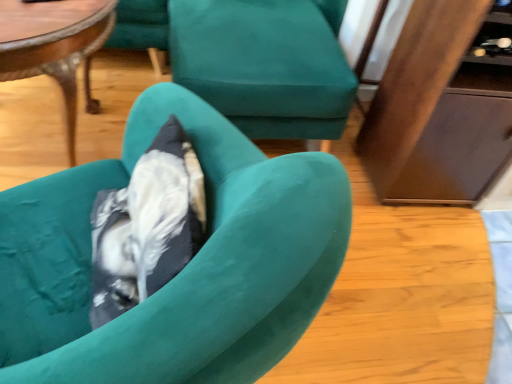
Locate an element on the screen. The width and height of the screenshot is (512, 384). wooden dresser at right is located at coordinates [441, 108].

Describe the element at coordinates (441, 108) in the screenshot. The width and height of the screenshot is (512, 384). I see `wooden dresser at right` at that location.

What is the approximate height of wooden polished coffee table at upper left?

wooden polished coffee table at upper left is 27.87 inches in height.

This screenshot has height=384, width=512. In order to click on velvet teal armchair at center, which ranks as the 2th chair in top-to-bottom order in this screenshot , I will do `click(183, 270)`.

Can you confirm if velvet teal armchair at center, acting as the 2th chair starting from the back, is positioned to the right of wooden dresser at right?

No, velvet teal armchair at center, acting as the 2th chair starting from the back, is not to the right of wooden dresser at right.

Does velvet teal armchair at center, acting as the 2th chair starting from the back, lie behind wooden dresser at right?

No, it is not.

Is wooden dresser at right at the back of velvet teal armchair at center, acting as the first chair starting from the front?

Yes.

Considering the sizes of objects wooden dresser at right and teal fabric chair at center, which ranks as the 1th chair in back-to-front order, in the image provided, who is shorter, wooden dresser at right or teal fabric chair at center, which ranks as the 1th chair in back-to-front order,?

teal fabric chair at center, which ranks as the 1th chair in back-to-front order.

Is wooden dresser at right situated inside teal fabric chair at center, which is the 2th chair in bottom-to-top order, or outside?

wooden dresser at right is outside teal fabric chair at center, which is the 2th chair in bottom-to-top order.

Is point (402, 54) behind point (192, 38)?

No, it is not.

From the picture: What's the angular difference between teal fabric chair at center, arranged as the first chair when viewed from the top, and wooden dresser at right's facing directions?

They differ by 1.64 degrees in their facing directions.

Which is behind, point (257, 75) or point (419, 10)?

The point (257, 75) is behind.

In terms of width, does teal fabric chair at center, arranged as the first chair when viewed from the top, look wider or thinner when compared to wooden dresser at right?

In the image, teal fabric chair at center, arranged as the first chair when viewed from the top, appears to be wider than wooden dresser at right.

From a real-world perspective, is teal fabric chair at center, arranged as the first chair when viewed from the top, above or below wooden dresser at right?

From a real-world perspective, teal fabric chair at center, arranged as the first chair when viewed from the top, is physically below wooden dresser at right.

The height and width of the screenshot is (384, 512). I want to click on coffee table below the teal fabric chair at center, which ranks as the 1th chair in back-to-front order (from the image's perspective), so click(x=56, y=50).

Is wooden polished coffee table at upper left aimed at teal fabric chair at center, which is the 2th chair in front-to-back order?

No.

From the image's perspective, is wooden polished coffee table at upper left located beneath teal fabric chair at center, arranged as the first chair when viewed from the top?

Correct, wooden polished coffee table at upper left appears lower than teal fabric chair at center, arranged as the first chair when viewed from the top, in the image.

How many degrees apart are the facing directions of wooden polished coffee table at upper left and teal fabric chair at center, which is the 2th chair in bottom-to-top order?

wooden polished coffee table at upper left and teal fabric chair at center, which is the 2th chair in bottom-to-top order, are facing 2.5 degrees away from each other.

Where is `coffee table located underneath the teal fabric chair at center, arranged as the first chair when viewed from the top (from a real-world perspective)`? The height and width of the screenshot is (384, 512). coffee table located underneath the teal fabric chair at center, arranged as the first chair when viewed from the top (from a real-world perspective) is located at coordinates (56, 50).

Is teal fabric chair at center, which ranks as the 1th chair in back-to-front order, directly adjacent to wooden polished coffee table at upper left?

No, teal fabric chair at center, which ranks as the 1th chair in back-to-front order, is not beside wooden polished coffee table at upper left.

From a real-world perspective, who is located higher, teal fabric chair at center, which is the 2th chair in front-to-back order, or wooden polished coffee table at upper left?

From a 3D spatial view, teal fabric chair at center, which is the 2th chair in front-to-back order, is above.

Is teal fabric chair at center, arranged as the first chair when viewed from the top, completely or partially inside velvet teal armchair at center, which ranks as the 2th chair in top-to-bottom order?

No, velvet teal armchair at center, which ranks as the 2th chair in top-to-bottom order, does not contain teal fabric chair at center, arranged as the first chair when viewed from the top.

Which object is further away from the camera taking this photo, velvet teal armchair at center, which ranks as the 2th chair in top-to-bottom order, or teal fabric chair at center, which is the 2th chair in front-to-back order?

Positioned behind is teal fabric chair at center, which is the 2th chair in front-to-back order.

Which is more to the left, velvet teal armchair at center, acting as the first chair starting from the front, or teal fabric chair at center, which is the 2th chair in bottom-to-top order?

velvet teal armchair at center, acting as the first chair starting from the front.

Considering the relative sizes of velvet teal armchair at center, positioned as the first chair in bottom-to-top order, and teal fabric chair at center, which is the 2th chair in front-to-back order, in the image provided, is velvet teal armchair at center, positioned as the first chair in bottom-to-top order, bigger than teal fabric chair at center, which is the 2th chair in front-to-back order,?

No, velvet teal armchair at center, positioned as the first chair in bottom-to-top order, is not bigger than teal fabric chair at center, which is the 2th chair in front-to-back order.

Is wooden polished coffee table at upper left next to velvet teal armchair at center, which ranks as the 2th chair in top-to-bottom order?

No, wooden polished coffee table at upper left is not with velvet teal armchair at center, which ranks as the 2th chair in top-to-bottom order.

Between wooden polished coffee table at upper left and velvet teal armchair at center, positioned as the first chair in bottom-to-top order, which one appears on the right side from the viewer's perspective?

velvet teal armchair at center, positioned as the first chair in bottom-to-top order, is more to the right.

From the image's perspective, is wooden polished coffee table at upper left on velvet teal armchair at center, which ranks as the 2th chair in top-to-bottom order?

Yes.

Does wooden polished coffee table at upper left turn towards velvet teal armchair at center, acting as the first chair starting from the front?

Yes, wooden polished coffee table at upper left faces towards velvet teal armchair at center, acting as the first chair starting from the front.

Image resolution: width=512 pixels, height=384 pixels. I want to click on chair located above the wooden dresser at right (from a real-world perspective), so click(183, 270).

Identify the location of chair above the wooden dresser at right (from the image's perspective). Image resolution: width=512 pixels, height=384 pixels. (264, 65).

Based on their spatial positions, is teal fabric chair at center, which is the 2th chair in bottom-to-top order, or velvet teal armchair at center, which ranks as the 2th chair in top-to-bottom order, closer to wooden polished coffee table at upper left?

The object closer to wooden polished coffee table at upper left is velvet teal armchair at center, which ranks as the 2th chair in top-to-bottom order.

Estimate the real-world distances between objects in this image. Which object is closer to teal fabric chair at center, which is the 2th chair in bottom-to-top order, velvet teal armchair at center, acting as the first chair starting from the front, or wooden polished coffee table at upper left?

wooden polished coffee table at upper left.

When comparing their distances from wooden dresser at right, does teal fabric chair at center, arranged as the first chair when viewed from the top, or velvet teal armchair at center, acting as the 2th chair starting from the back, seem closer?

teal fabric chair at center, arranged as the first chair when viewed from the top, is positioned closer to the anchor wooden dresser at right.

From the image, which object appears to be nearer to teal fabric chair at center, which is the 2th chair in bottom-to-top order, wooden polished coffee table at upper left or wooden dresser at right?

wooden dresser at right is closer to teal fabric chair at center, which is the 2th chair in bottom-to-top order.

Estimate the real-world distances between objects in this image. Which object is closer to teal fabric chair at center, arranged as the first chair when viewed from the top, velvet teal armchair at center, which ranks as the 2th chair in top-to-bottom order, or wooden dresser at right?

wooden dresser at right is positioned closer to the anchor teal fabric chair at center, arranged as the first chair when viewed from the top.

Which object lies nearer to the anchor point wooden polished coffee table at upper left, velvet teal armchair at center, acting as the first chair starting from the front, or teal fabric chair at center, which is the 2th chair in front-to-back order?

velvet teal armchair at center, acting as the first chair starting from the front, is closer to wooden polished coffee table at upper left.

Looking at the image, which one is located closer to wooden dresser at right, wooden polished coffee table at upper left or velvet teal armchair at center, which ranks as the 2th chair in top-to-bottom order?

velvet teal armchair at center, which ranks as the 2th chair in top-to-bottom order, lies closer to wooden dresser at right than the other object.

Estimate the real-world distances between objects in this image. Which object is closer to wooden polished coffee table at upper left, wooden dresser at right or velvet teal armchair at center, acting as the 2th chair starting from the back?

velvet teal armchair at center, acting as the 2th chair starting from the back, lies closer to wooden polished coffee table at upper left than the other object.

Locate an element on the screen. The width and height of the screenshot is (512, 384). coffee table between teal fabric chair at center, which is the 2th chair in bottom-to-top order, and velvet teal armchair at center, acting as the 2th chair starting from the back, in the vertical direction is located at coordinates (56, 50).

You are a GUI agent. You are given a task and a screenshot of the screen. Output one action in this format:
    pyautogui.click(x=<x>, y=<y>)
    Task: Click on the chair between velvet teal armchair at center, which ranks as the 2th chair in top-to-bottom order, and wooden dresser at right
    
    Given the screenshot: What is the action you would take?
    pyautogui.click(x=264, y=65)